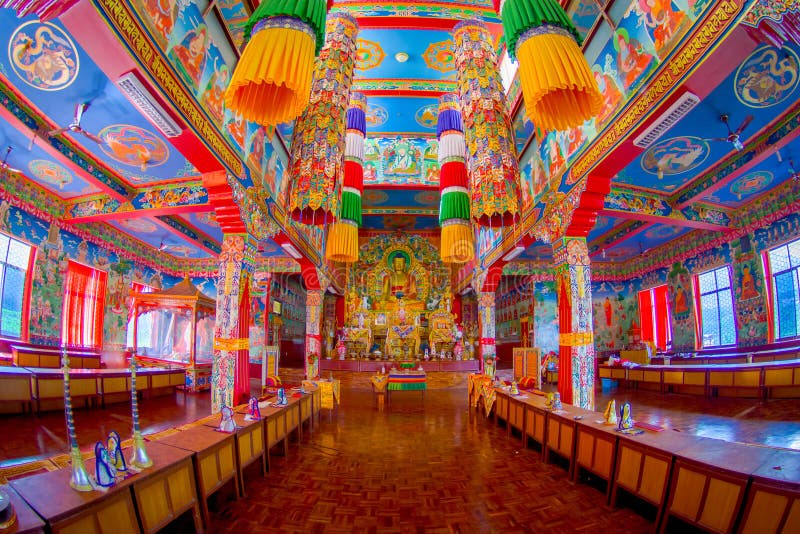
At what (x,y) coordinates should I click in order to perform the action: click on decorative tubes hanging from the ceiling. Please return your answer as a coordinate pair (x, y). The width and height of the screenshot is (800, 534). Looking at the image, I should click on (486, 96), (330, 128).